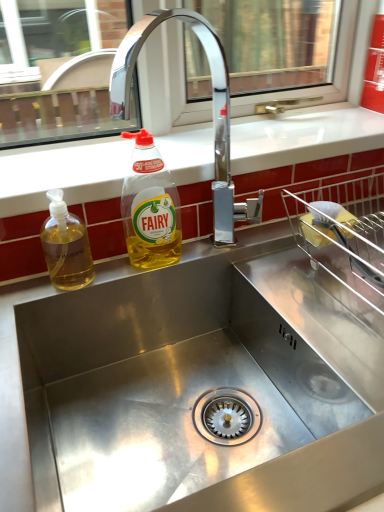
Question: From the image's perspective, is translucent yellow liquid at sink left, the 2th bottle when ordered from right to left, over yellow translucent liquid at upper center, positioned as the first bottle in right-to-left order?

Choices:
 (A) no
 (B) yes

Answer: (A)

Question: Is translucent yellow liquid at sink left, the 2th bottle when ordered from right to left, not inside yellow translucent liquid at upper center, positioned as the first bottle in right-to-left order?

Choices:
 (A) yes
 (B) no

Answer: (A)

Question: Considering the relative sizes of translucent yellow liquid at sink left, the 2th bottle when ordered from right to left, and yellow translucent liquid at upper center, positioned as the first bottle in right-to-left order, in the image provided, is translucent yellow liquid at sink left, the 2th bottle when ordered from right to left, smaller than yellow translucent liquid at upper center, positioned as the first bottle in right-to-left order,?

Choices:
 (A) no
 (B) yes

Answer: (B)

Question: From the image's perspective, does translucent yellow liquid at sink left, which is counted as the first bottle, starting from the left, appear lower than yellow translucent liquid at upper center, positioned as the first bottle in right-to-left order?

Choices:
 (A) no
 (B) yes

Answer: (B)

Question: Can you confirm if translucent yellow liquid at sink left, which is counted as the first bottle, starting from the left, is shorter than yellow translucent liquid at upper center, positioned as the first bottle in right-to-left order?

Choices:
 (A) no
 (B) yes

Answer: (B)

Question: From a real-world perspective, is white glossy countertop at upper center above or below translucent yellow liquid at sink left, which is counted as the first bottle, starting from the left?

Choices:
 (A) below
 (B) above

Answer: (B)

Question: Is point (357, 136) closer or farther from the camera than point (76, 217)?

Choices:
 (A) closer
 (B) farther

Answer: (B)

Question: Considering the positions of white glossy countertop at upper center and translucent yellow liquid at sink left, which is counted as the first bottle, starting from the left, in the image, is white glossy countertop at upper center wider or thinner than translucent yellow liquid at sink left, which is counted as the first bottle, starting from the left,?

Choices:
 (A) thin
 (B) wide

Answer: (B)

Question: From the image's perspective, is white glossy countertop at upper center positioned above or below translucent yellow liquid at sink left, which is counted as the first bottle, starting from the left?

Choices:
 (A) below
 (B) above

Answer: (B)

Question: Is chrome metallic faucet at upper center in front of or behind yellow translucent liquid at upper center, positioned as the first bottle in right-to-left order, in the image?

Choices:
 (A) front
 (B) behind

Answer: (A)

Question: From the image's perspective, is chrome metallic faucet at upper center positioned above or below yellow translucent liquid at upper center, which is counted as the second bottle, starting from the left?

Choices:
 (A) below
 (B) above

Answer: (B)

Question: Is chrome metallic faucet at upper center spatially inside yellow translucent liquid at upper center, positioned as the first bottle in right-to-left order, or outside of it?

Choices:
 (A) inside
 (B) outside

Answer: (B)

Question: Is chrome metallic faucet at upper center wider or thinner than yellow translucent liquid at upper center, positioned as the first bottle in right-to-left order?

Choices:
 (A) wide
 (B) thin

Answer: (A)

Question: From the image's perspective, is chrome metallic faucet at upper center positioned above or below translucent yellow liquid at sink left, the 2th bottle when ordered from right to left?

Choices:
 (A) below
 (B) above

Answer: (B)

Question: Is chrome metallic faucet at upper center taller or shorter than translucent yellow liquid at sink left, the 2th bottle when ordered from right to left?

Choices:
 (A) short
 (B) tall

Answer: (B)